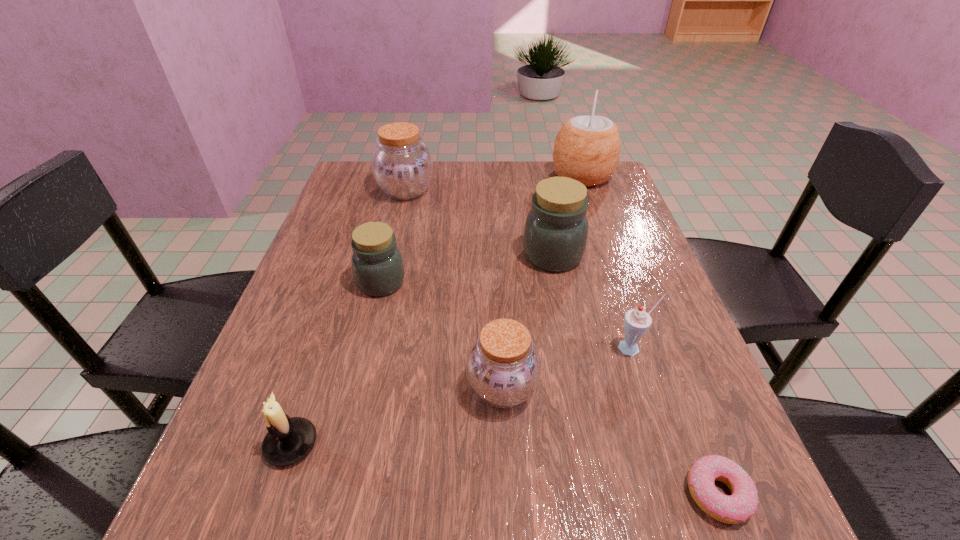
Identify the location of pink doughnut. (742, 504).

The height and width of the screenshot is (540, 960). Find the location of `doughnut`. doughnut is located at coordinates (742, 504).

Locate an element on the screen. The width and height of the screenshot is (960, 540). vacant space located 0.200m on the left of the tallest object is located at coordinates (484, 176).

Find the location of a particular element. free space located 0.320m on the right of the bigger brown jar is located at coordinates (547, 191).

I want to click on vacant region located 0.150m on the right of the right green jar, so click(x=647, y=255).

In order to click on free space located on the front of the left green jar in this screenshot , I will do `click(365, 348)`.

Locate an element on the screen. Image resolution: width=960 pixels, height=540 pixels. vacant area situated on the right of the smaller brown jar is located at coordinates (573, 388).

Where is `vacant area situated on the straw side of the white milkshake`? This screenshot has width=960, height=540. vacant area situated on the straw side of the white milkshake is located at coordinates coord(682,497).

You are a GUI agent. You are given a task and a screenshot of the screen. Output one action in this format:
    pyautogui.click(x=<x>, y=<y>)
    Task: Click on the vacant space located 0.170m on the back of the candle holder
    Image resolution: width=960 pixels, height=540 pixels.
    Given the screenshot: What is the action you would take?
    pyautogui.click(x=325, y=340)

Locate an element on the screen. The width and height of the screenshot is (960, 540). free space located 0.170m on the left of the doughnut is located at coordinates tap(568, 493).